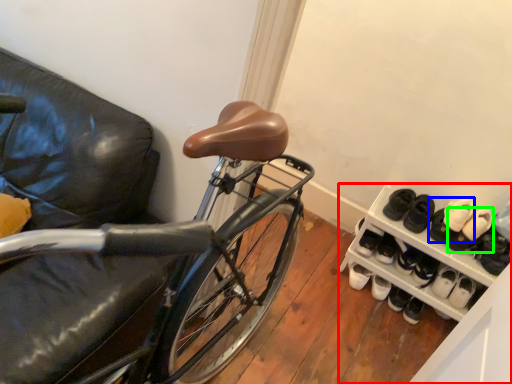
Question: Which object is positioned farthest from cabinetry (highlighted by a red box)? Select from footwear (highlighted by a blue box) and footwear (highlighted by a green box).

Choices:
 (A) footwear
 (B) footwear

Answer: (B)